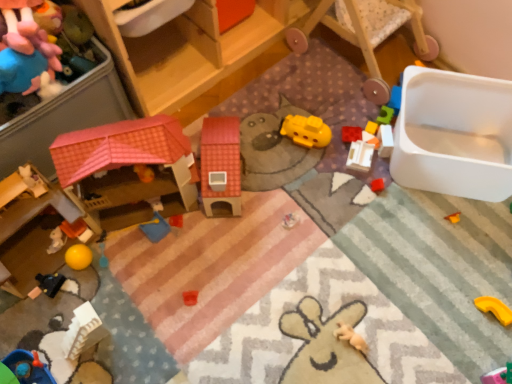
The image size is (512, 384). What are the coordinates of `free location to the left of blue fabric toy at center, acting as the ninth toy starting from the right` in the screenshot? It's located at (115, 243).